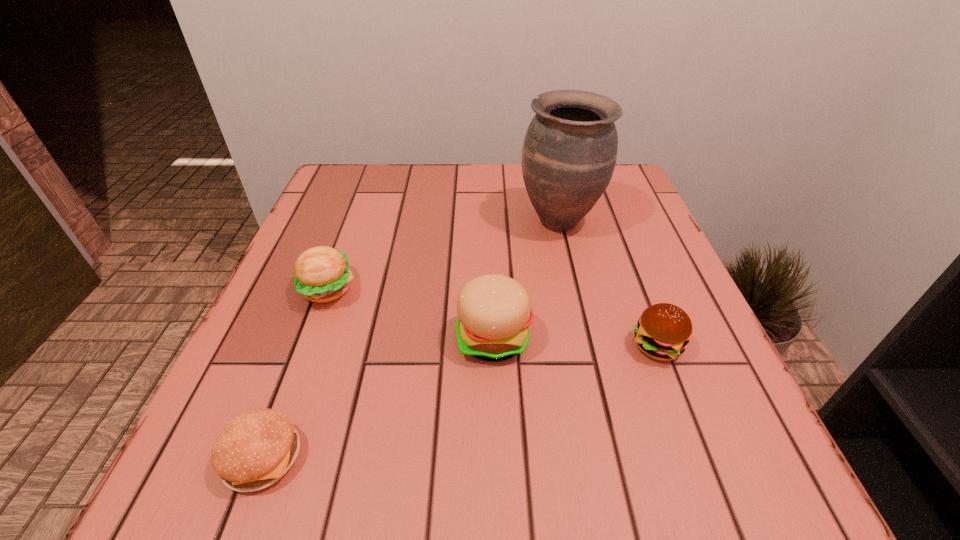
Find the location of a particular element. vacant space situated on the right of the shortest object is located at coordinates (457, 456).

You are a GUI agent. You are given a task and a screenshot of the screen. Output one action in this format:
    pyautogui.click(x=<x>, y=<y>)
    Task: Click on the object that is at the far edge
    This screenshot has height=540, width=960.
    Given the screenshot: What is the action you would take?
    pyautogui.click(x=569, y=153)

This screenshot has width=960, height=540. Find the location of `object located at the near edge`. object located at the near edge is located at coordinates (254, 450).

This screenshot has height=540, width=960. I want to click on urn that is at the right edge, so click(569, 153).

Where is `hamburger that is at the right edge`? The height and width of the screenshot is (540, 960). hamburger that is at the right edge is located at coordinates (663, 331).

You are a GUI agent. You are given a task and a screenshot of the screen. Output one action in this format:
    pyautogui.click(x=<x>, y=<y>)
    Task: Click on the object at the near left corner
    This screenshot has width=960, height=540.
    Given the screenshot: What is the action you would take?
    pyautogui.click(x=254, y=450)

Where is `object situated at the far right corner`? This screenshot has width=960, height=540. object situated at the far right corner is located at coordinates (569, 153).

In the image, there is a desktop. At what (x,y) coordinates should I click in order to perform the action: click on vacant space at the far edge. Please return your answer as a coordinate pair (x, y). Looking at the image, I should click on (503, 214).

Where is `vacant point at the near edge`? The width and height of the screenshot is (960, 540). vacant point at the near edge is located at coordinates (520, 462).

Where is `blank area at the left edge`? Image resolution: width=960 pixels, height=540 pixels. blank area at the left edge is located at coordinates (279, 280).